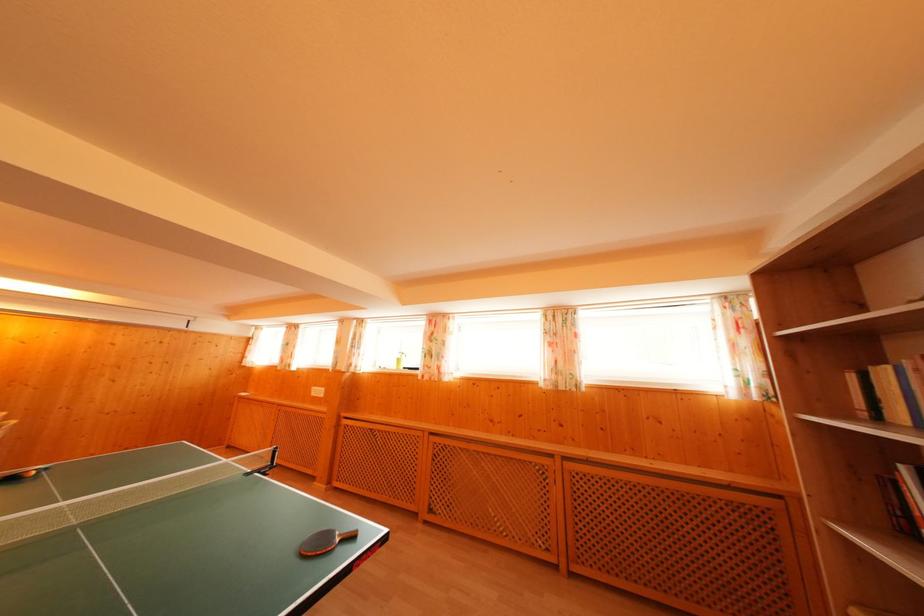
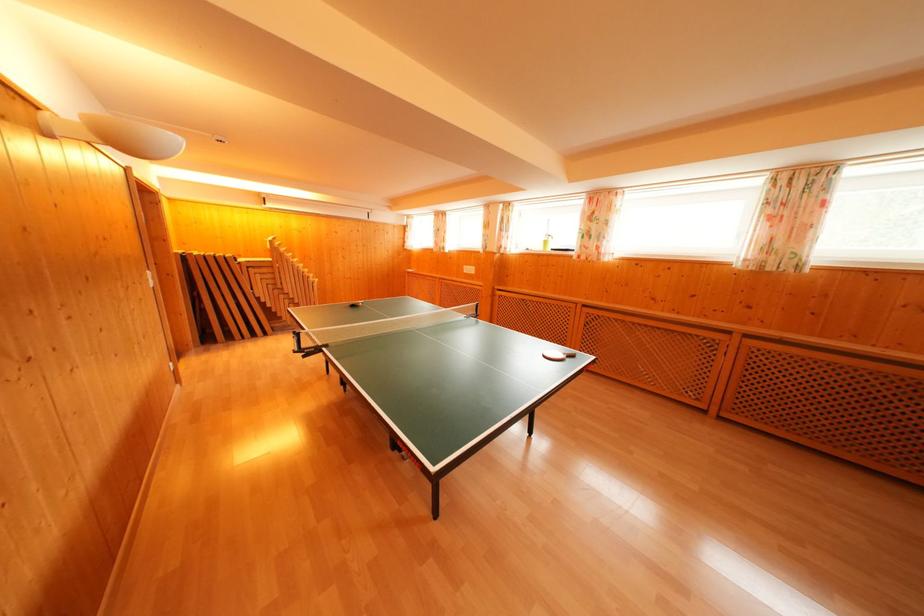
First-person continuous shooting, in which direction is the camera rotating?

The camera rotated toward left-down.